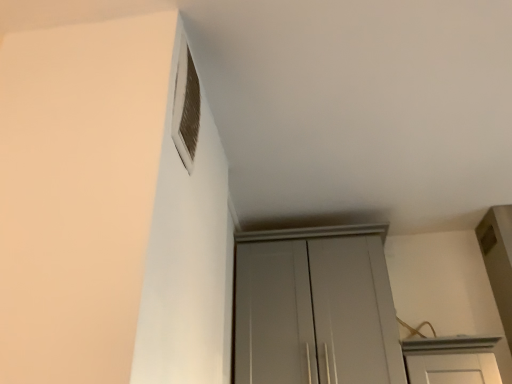
Question: Does white textured vent at upper left come in front of matte gray cupboard at center?

Choices:
 (A) yes
 (B) no

Answer: (A)

Question: Can you confirm if white textured vent at upper left is taller than matte gray cupboard at center?

Choices:
 (A) yes
 (B) no

Answer: (B)

Question: From a real-world perspective, is white textured vent at upper left below matte gray cupboard at center?

Choices:
 (A) yes
 (B) no

Answer: (B)

Question: From the image's perspective, does white textured vent at upper left appear lower than matte gray cupboard at center?

Choices:
 (A) yes
 (B) no

Answer: (B)

Question: Is white textured vent at upper left far from matte gray cupboard at center?

Choices:
 (A) yes
 (B) no

Answer: (B)

Question: Considering the relative sizes of white textured vent at upper left and matte gray cupboard at center in the image provided, is white textured vent at upper left thinner than matte gray cupboard at center?

Choices:
 (A) no
 (B) yes

Answer: (B)

Question: Is matte gray cupboard at center thinner than white textured vent at upper left?

Choices:
 (A) no
 (B) yes

Answer: (A)

Question: Can you confirm if matte gray cupboard at center is wider than white textured vent at upper left?

Choices:
 (A) no
 (B) yes

Answer: (B)

Question: Is matte gray cupboard at center surrounding white textured vent at upper left?

Choices:
 (A) no
 (B) yes

Answer: (A)

Question: Is the position of matte gray cupboard at center less distant than that of white textured vent at upper left?

Choices:
 (A) yes
 (B) no

Answer: (B)

Question: From a real-world perspective, is matte gray cupboard at center located higher than white textured vent at upper left?

Choices:
 (A) yes
 (B) no

Answer: (B)

Question: Is matte gray cupboard at center to the right of white textured vent at upper left from the viewer's perspective?

Choices:
 (A) no
 (B) yes

Answer: (B)

Question: Is white textured vent at upper left wider or thinner than matte gray cupboard at center?

Choices:
 (A) wide
 (B) thin

Answer: (B)